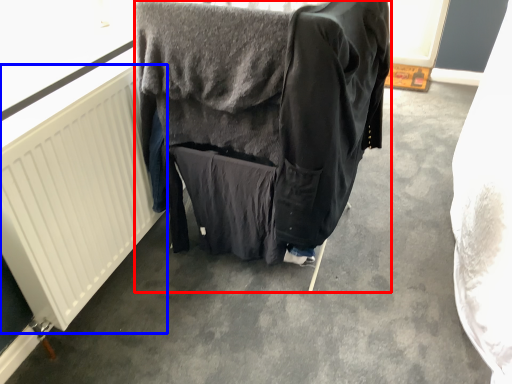
Question: Among these objects, which one is farthest to the camera, furniture (highlighted by a red box) or radiator (highlighted by a blue box)?

Choices:
 (A) furniture
 (B) radiator

Answer: (A)